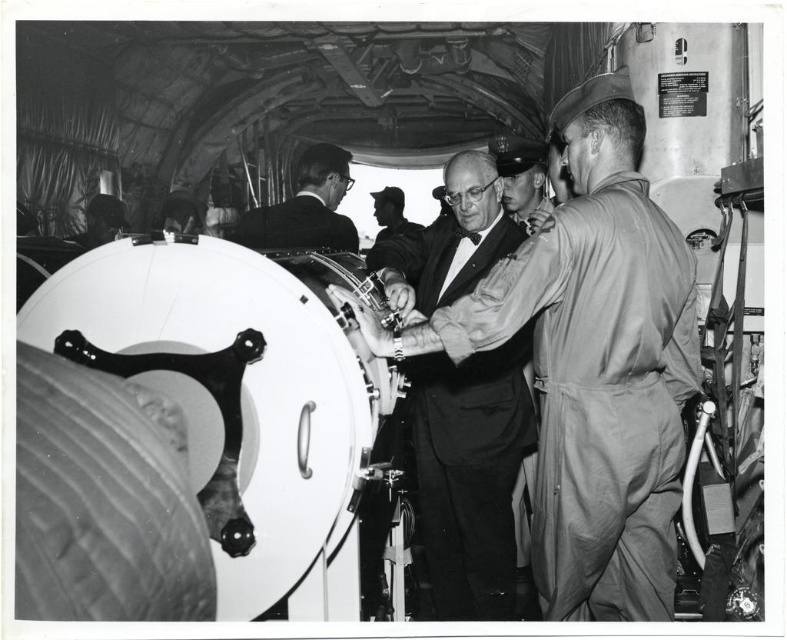
Does smooth black suit at center have a lesser width compared to smooth leather cap at center?

Incorrect, smooth black suit at center's width is not less than smooth leather cap at center's.

Which is above, smooth black suit at center or smooth leather cap at center?

smooth leather cap at center is above.

Image resolution: width=787 pixels, height=640 pixels. In order to click on smooth black suit at center in this screenshot , I will do tap(470, 474).

Image resolution: width=787 pixels, height=640 pixels. Identify the location of smooth black suit at center. (470, 474).

Which is above, smooth black suit at center or dark hair at upper left?

dark hair at upper left is above.

Is smooth black suit at center positioned behind dark hair at upper left?

No.

Where is `smooth black suit at center`? smooth black suit at center is located at coordinates (470, 474).

Where is `smooth black suit at center`? This screenshot has height=640, width=787. smooth black suit at center is located at coordinates (470, 474).

Does smooth fabric suit at center have a lesser width compared to dark suit jacket at center?

Incorrect, smooth fabric suit at center's width is not less than dark suit jacket at center's.

Is point (590, 209) more distant than point (348, 218)?

No, (590, 209) is closer to viewer.

Where is `smooth fabric suit at center`? smooth fabric suit at center is located at coordinates (597, 364).